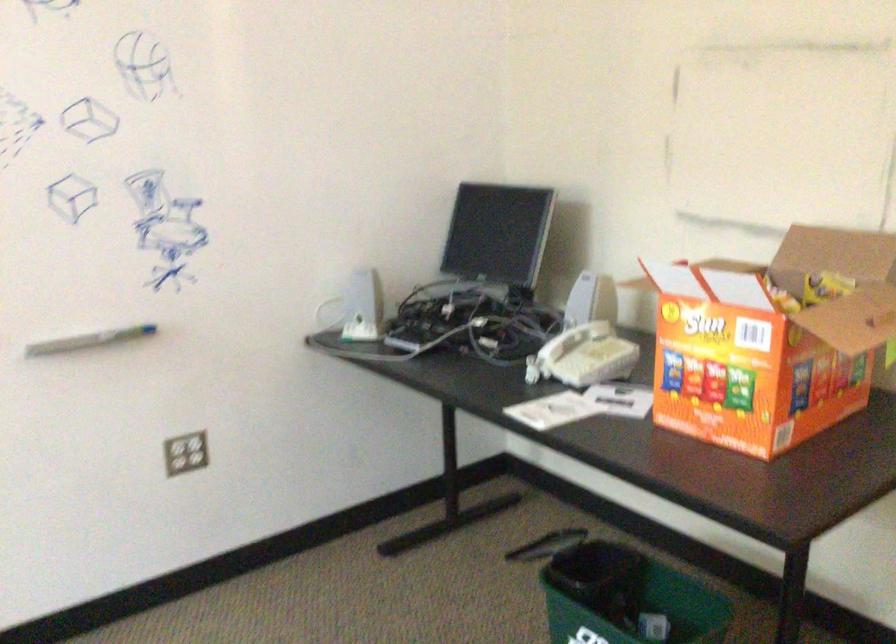
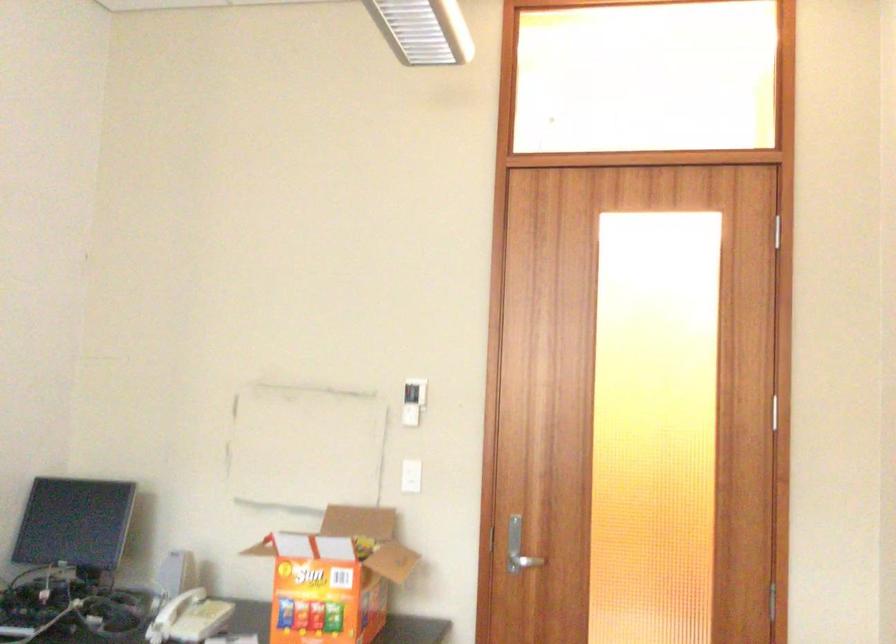
The point at (553, 361) is marked in the first image. Where is the corresponding point in the second image?

(170, 617)